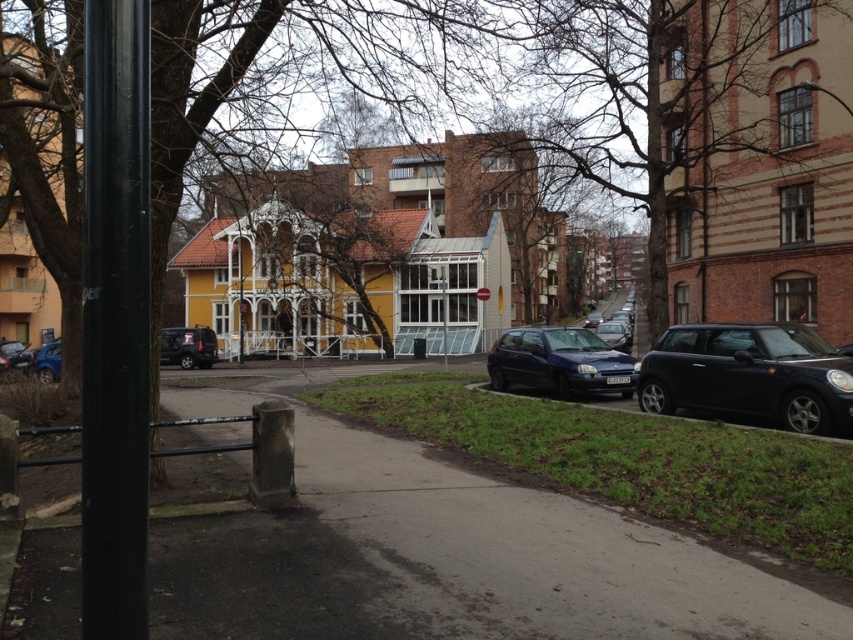
Question: Which of these objects is positioned farthest from the satin blue hatchback at center?

Choices:
 (A) metallic blue car at lower left
 (B) glossy black car at lower right
 (C) shiny black suv at lower left

Answer: (A)

Question: Does shiny black suv at lower left appear over metallic reflective sign at center?

Choices:
 (A) no
 (B) yes

Answer: (A)

Question: Which of these objects is positioned farthest from the metallic reflective sign at center?

Choices:
 (A) glossy black car at lower right
 (B) concrete pavement at center

Answer: (B)

Question: Is bare branches at center further to camera compared to brown textured tree at center?

Choices:
 (A) no
 (B) yes

Answer: (B)

Question: Is satin blue hatchback at center thinner than metallic reflective sign at center?

Choices:
 (A) no
 (B) yes

Answer: (A)

Question: Which of the following is the farthest from the observer?

Choices:
 (A) (706, 387)
 (B) (22, 368)
 (C) (471, 524)
 (D) (701, 29)

Answer: (B)